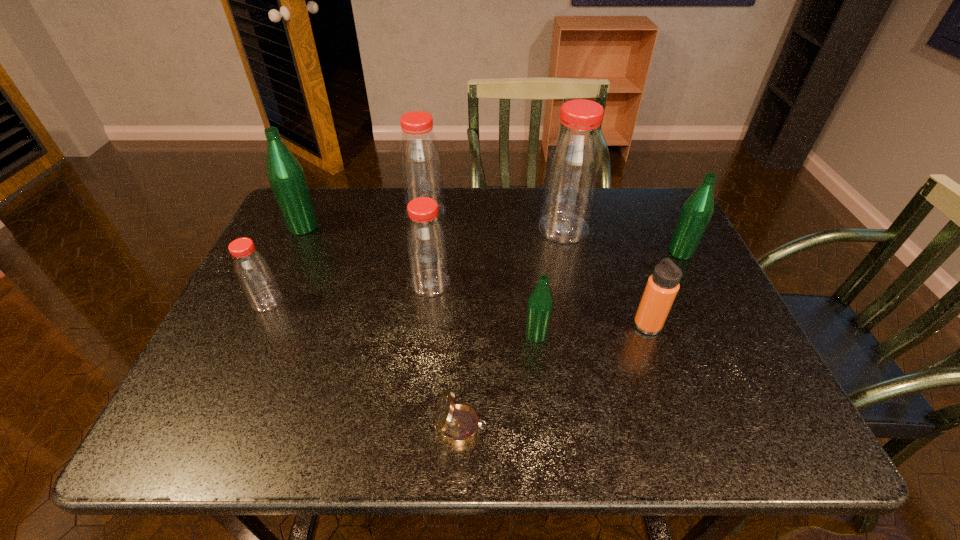
Image resolution: width=960 pixels, height=540 pixels. What are the coordinates of `free space that satisfies the following two spatial constraints: 1. on the front side of the second nearest green bottle; 2. with the dial facing the compass` in the screenshot? It's located at (768, 427).

Where is `blank space that satisfies the following two spatial constraints: 1. on the back side of the smallest green bottle; 2. on the right side of the rightmost object`? The image size is (960, 540). blank space that satisfies the following two spatial constraints: 1. on the back side of the smallest green bottle; 2. on the right side of the rightmost object is located at coordinates [x=527, y=252].